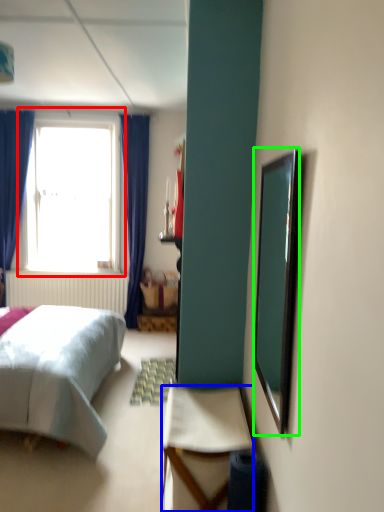
Question: Estimate the real-world distances between objects in this image. Which object is closer to window (highlighted by a red box), desk (highlighted by a blue box) or mirror (highlighted by a green box)?

Choices:
 (A) desk
 (B) mirror

Answer: (A)